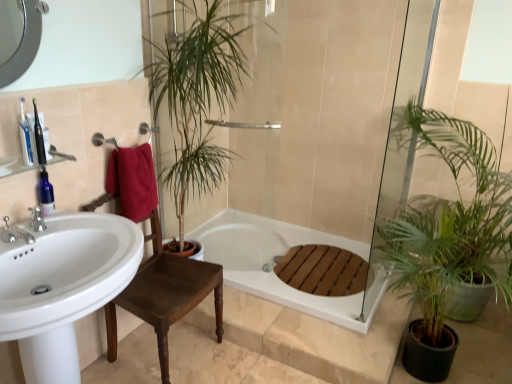
Question: From their relative heights in the image, would you say brown wooden chair at center is taller or shorter than white glossy sink at left?

Choices:
 (A) tall
 (B) short

Answer: (B)

Question: Looking at their shapes, would you say brown wooden chair at center is wider or thinner than white glossy sink at left?

Choices:
 (A) wide
 (B) thin

Answer: (B)

Question: Considering the real-world distances, which object is farthest from the black plastic toothbrush at left, the 2th toiletry when ordered from back to front?

Choices:
 (A) silver metallic faucet at left, the second tap viewed from the front
 (B) white glossy sink at left
 (C) red cotton towel at upper left
 (D) blue glass toothbrush at upper left
 (E) white matte bathtub at center

Answer: (E)

Question: Which is nearer to the brushed metal faucet at left, which appears as the 1th tap when viewed from the front?

Choices:
 (A) white matte bathtub at center
 (B) translucent plastic toothbrush at upper left, the third toiletry positioned from the back
 (C) green leafy plant at right, which is the 1th houseplant from right to left
 (D) blue glass toothbrush at upper left
 (E) black plastic toothbrush at left, placed as the second toiletry when sorted from front to back

Answer: (D)